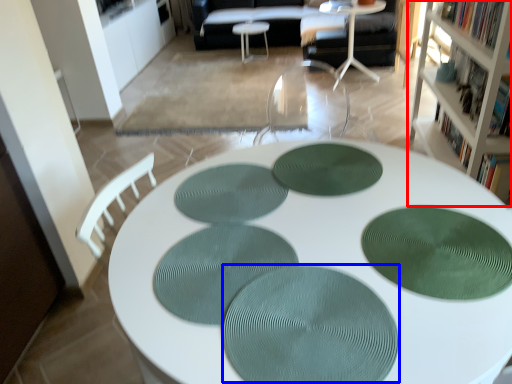
Question: Which of the following is the farthest to the observer, cabinetry (highlighted by a red box) or oval (highlighted by a blue box)?

Choices:
 (A) cabinetry
 (B) oval

Answer: (A)